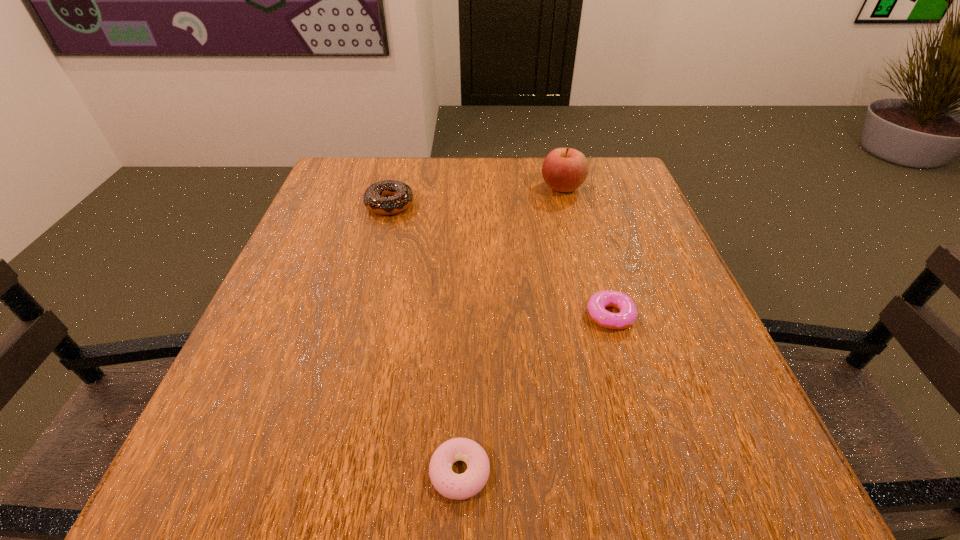
Locate an element on the screen. the tallest object is located at coordinates (564, 169).

Identify the location of the farthest doughnut. The width and height of the screenshot is (960, 540). (388, 197).

The height and width of the screenshot is (540, 960). I want to click on the leftmost doughnut, so click(x=388, y=197).

Identify the location of the rightmost doughnut. The height and width of the screenshot is (540, 960). (597, 303).

This screenshot has width=960, height=540. Find the location of `the third farthest object`. the third farthest object is located at coordinates (597, 303).

Where is `the nearest doughnut`? the nearest doughnut is located at coordinates (462, 486).

Identify the location of the second object from left to right. The height and width of the screenshot is (540, 960). (462, 486).

The height and width of the screenshot is (540, 960). Identify the location of vacant space located 0.240m on the left of the tallest object. (446, 187).

The width and height of the screenshot is (960, 540). In order to click on free space located 0.080m on the right of the farthest doughnut in this screenshot , I will do [447, 205].

Identify the location of vacant space located 0.260m on the back of the second nearest object. This screenshot has width=960, height=540. (583, 218).